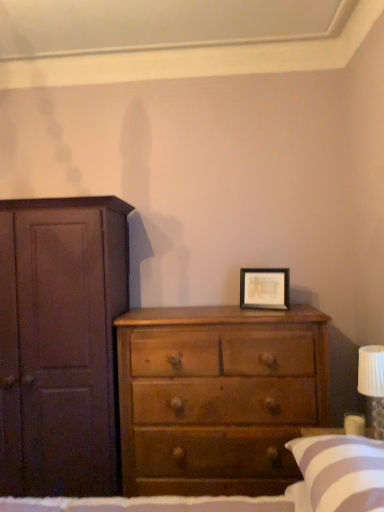
What do you see at coordinates (373, 383) in the screenshot?
I see `white pleated fabric at right` at bounding box center [373, 383].

The image size is (384, 512). Describe the element at coordinates (218, 397) in the screenshot. I see `light brown wood chest of drawers at center` at that location.

Where is `white pleated fabric at right`? white pleated fabric at right is located at coordinates (373, 383).

From the image's perspective, is light brown wood chest of drawers at center on matte dark brown cupboard at left?

Actually, light brown wood chest of drawers at center appears below matte dark brown cupboard at left in the image.

Consider the image. Is light brown wood chest of drawers at center to the left of matte dark brown cupboard at left from the viewer's perspective?

No.

Considering the positions of objects light brown wood chest of drawers at center and matte dark brown cupboard at left in the image provided, who is behind, light brown wood chest of drawers at center or matte dark brown cupboard at left?

matte dark brown cupboard at left is further from the camera.

Is light brown wood chest of drawers at center not within matte dark brown cupboard at left?

That's correct, light brown wood chest of drawers at center is outside of matte dark brown cupboard at left.

Which object is positioned more to the left, light brown wood chest of drawers at center or white striped pillow at lower right?

light brown wood chest of drawers at center.

Considering the sizes of light brown wood chest of drawers at center and white striped pillow at lower right in the image, is light brown wood chest of drawers at center taller or shorter than white striped pillow at lower right?

light brown wood chest of drawers at center is taller than white striped pillow at lower right.

From the image's perspective, who appears lower, light brown wood chest of drawers at center or white striped pillow at lower right?

light brown wood chest of drawers at center is shown below in the image.

Where is `chest of drawers behind the white striped pillow at lower right`? The width and height of the screenshot is (384, 512). chest of drawers behind the white striped pillow at lower right is located at coordinates (218, 397).

Visually, is white pleated fabric at right positioned to the left or to the right of wooden framed artwork at center right?

In the image, white pleated fabric at right appears on the right side of wooden framed artwork at center right.

Is white pleated fabric at right facing towards wooden framed artwork at center right?

No, white pleated fabric at right is not oriented towards wooden framed artwork at center right.

From a real-world perspective, which is physically below, white pleated fabric at right or wooden framed artwork at center right?

white pleated fabric at right is physically lower.

Is white pleated fabric at right wider than wooden framed artwork at center right?

Correct, the width of white pleated fabric at right exceeds that of wooden framed artwork at center right.

Is white pleated fabric at right surrounded by matte dark brown cupboard at left?

No, white pleated fabric at right is not surrounded by matte dark brown cupboard at left.

Does matte dark brown cupboard at left have a smaller size compared to white pleated fabric at right?

No, matte dark brown cupboard at left is not smaller than white pleated fabric at right.

Can you tell me how much matte dark brown cupboard at left and white pleated fabric at right differ in facing direction?

There is a 93.6-degree angle between the facing directions of matte dark brown cupboard at left and white pleated fabric at right.

From a real-world perspective, between matte dark brown cupboard at left and white pleated fabric at right, who is vertically lower?

In real-world perspective, matte dark brown cupboard at left is lower.

From the picture: Would you consider light brown wood chest of drawers at center to be distant from white pleated fabric at right?

No.

Between point (158, 323) and point (376, 411), which one is positioned behind?

The point (158, 323) is farther.

Considering the relative sizes of light brown wood chest of drawers at center and white pleated fabric at right in the image provided, is light brown wood chest of drawers at center smaller than white pleated fabric at right?

Actually, light brown wood chest of drawers at center might be larger than white pleated fabric at right.

Which is more to the right, light brown wood chest of drawers at center or white pleated fabric at right?

Positioned to the right is white pleated fabric at right.

Are light brown wood chest of drawers at center and wooden framed artwork at center right far apart?

They are positioned close to each other.

Is light brown wood chest of drawers at center oriented towards wooden framed artwork at center right?

No, light brown wood chest of drawers at center is not turned towards wooden framed artwork at center right.

Which of these two, light brown wood chest of drawers at center or wooden framed artwork at center right, is bigger?

Bigger between the two is light brown wood chest of drawers at center.

Who is smaller, white pleated fabric at right or white striped pillow at lower right?

Smaller between the two is white pleated fabric at right.

Find the location of a particular element. pillow that is on the left side of white pleated fabric at right is located at coordinates tap(341, 472).

Between white pleated fabric at right and white striped pillow at lower right, which one has more height?

white pleated fabric at right is taller.

This screenshot has height=512, width=384. What are the coordinates of `cupboard on the left side of light brown wood chest of drawers at center` in the screenshot? It's located at (60, 343).

Find the location of a particular element. The width and height of the screenshot is (384, 512). chest of drawers below the white striped pillow at lower right (from the image's perspective) is located at coordinates (218, 397).

Which object lies further to the anchor point wooden framed artwork at center right, white pleated fabric at right or white striped pillow at lower right?

Based on the image, white striped pillow at lower right appears to be further to wooden framed artwork at center right.

Considering their positions, is white striped pillow at lower right positioned closer to matte dark brown cupboard at left than white pleated fabric at right?

white striped pillow at lower right is closer to matte dark brown cupboard at left.

Looking at the image, which one is located further to matte dark brown cupboard at left, white pleated fabric at right or wooden framed artwork at center right?

white pleated fabric at right is positioned further to the anchor matte dark brown cupboard at left.

Looking at this image, from the image, which object appears to be nearer to white pleated fabric at right, matte dark brown cupboard at left or light brown wood chest of drawers at center?

Based on the image, light brown wood chest of drawers at center appears to be nearer to white pleated fabric at right.

When comparing their distances from wooden framed artwork at center right, does white striped pillow at lower right or matte dark brown cupboard at left seem further?

white striped pillow at lower right.

Which object lies nearer to the anchor point white striped pillow at lower right, light brown wood chest of drawers at center or matte dark brown cupboard at left?

light brown wood chest of drawers at center.

Considering their positions, is white pleated fabric at right positioned further to matte dark brown cupboard at left than white striped pillow at lower right?

white pleated fabric at right.

When comparing their distances from matte dark brown cupboard at left, does wooden framed artwork at center right or white striped pillow at lower right seem closer?

wooden framed artwork at center right lies closer to matte dark brown cupboard at left than the other object.

Where is `chest of drawers between white striped pillow at lower right and wooden framed artwork at center right along the z-axis`? The image size is (384, 512). chest of drawers between white striped pillow at lower right and wooden framed artwork at center right along the z-axis is located at coordinates (218, 397).

Image resolution: width=384 pixels, height=512 pixels. I want to click on bedside lamp located between white striped pillow at lower right and wooden framed artwork at center right in the depth direction, so click(x=373, y=383).

What are the coordinates of `chest of drawers between matte dark brown cupboard at left and white striped pillow at lower right from left to right` in the screenshot? It's located at (218, 397).

Find the location of a particular element. The height and width of the screenshot is (512, 384). pillow between matte dark brown cupboard at left and white pleated fabric at right is located at coordinates (341, 472).